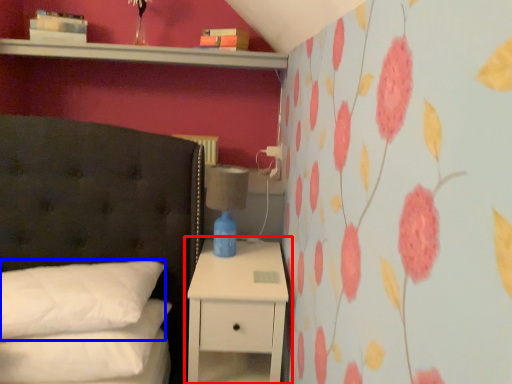
Question: Which point is further to the camera, nightstand (highlighted by a red box) or pillow (highlighted by a blue box)?

Choices:
 (A) nightstand
 (B) pillow

Answer: (A)